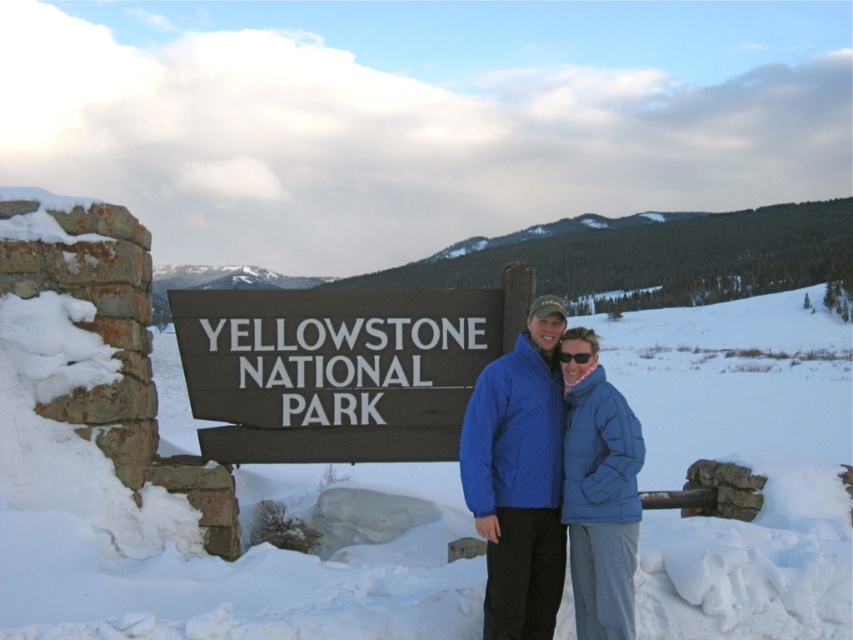
Question: Which point is farther from the camera taking this photo?

Choices:
 (A) (573, 356)
 (B) (254, 314)
 (C) (605, 534)

Answer: (B)

Question: Which object appears farthest from the camera in this image?

Choices:
 (A) black plastic sunglasses at center
 (B) blue puffy jacket at center

Answer: (A)

Question: Which point appears closest to the camera in this image?

Choices:
 (A) (602, 401)
 (B) (488, 348)
 (C) (550, 358)
 (D) (381, 595)

Answer: (A)

Question: Does white powdery snow at center appear on the right side of brown wooden sign at center?

Choices:
 (A) no
 (B) yes

Answer: (A)

Question: Is brown wooden sign at center wider than blue puffy jackets at center?

Choices:
 (A) no
 (B) yes

Answer: (B)

Question: From the image, what is the correct spatial relationship of white powdery snow at center in relation to brown wooden sign at center?

Choices:
 (A) below
 (B) above

Answer: (A)